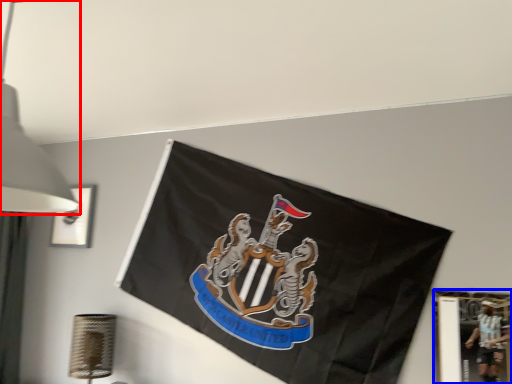
Question: Which of the following is the closest to the observer, lamp (highlighted by a red box) or picture frame (highlighted by a blue box)?

Choices:
 (A) lamp
 (B) picture frame

Answer: (A)